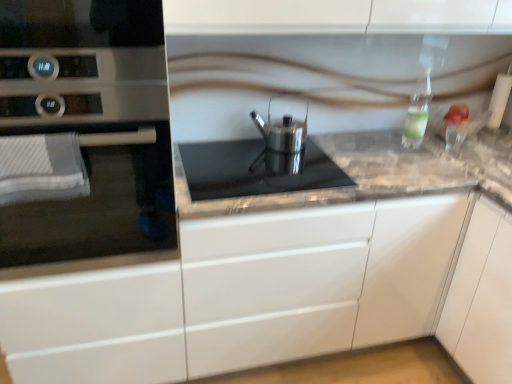
Locate an element on the screen. blank space above satin silver cookware at center (from a real-world perspective) is located at coordinates (252, 173).